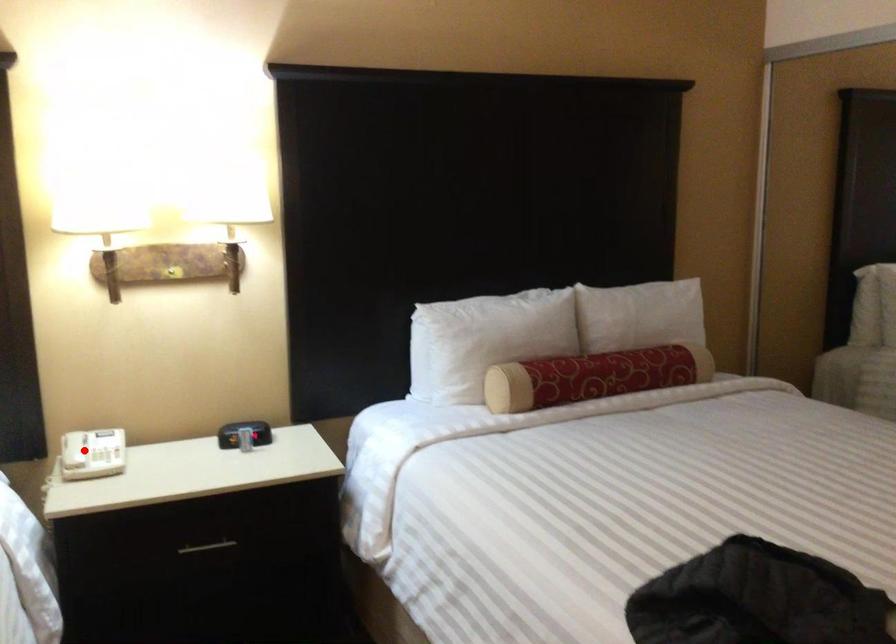
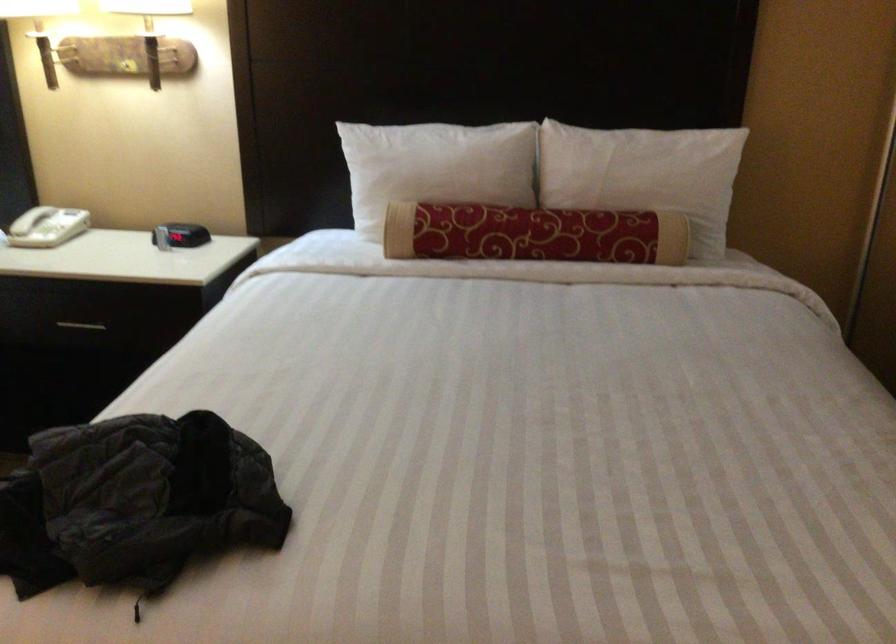
Question: I am providing you with two images of the same scene from different viewpoints. A red point is shown in image1. For the corresponding object point in image2, is it positioned nearer or farther from the camera?

Choices:
 (A) Nearer
 (B) Farther

Answer: (B)